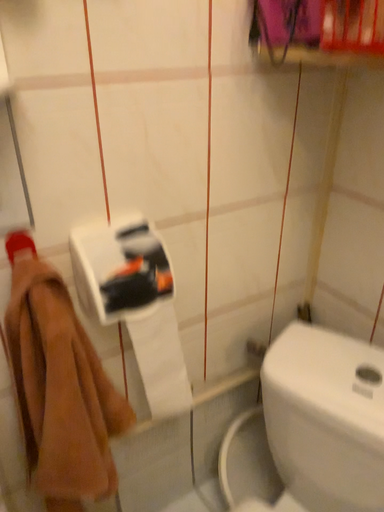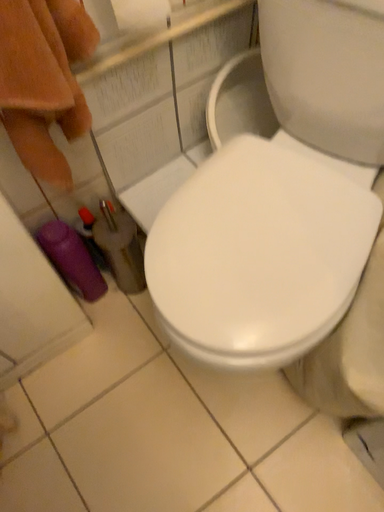
Question: How did the camera likely rotate when shooting the video?

Choices:
 (A) rotated downward
 (B) rotated upward

Answer: (A)